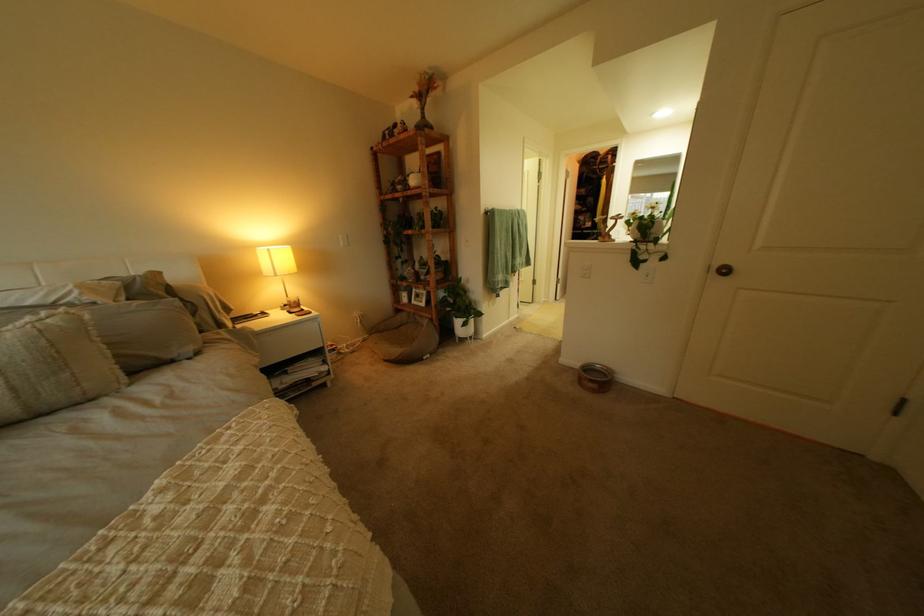
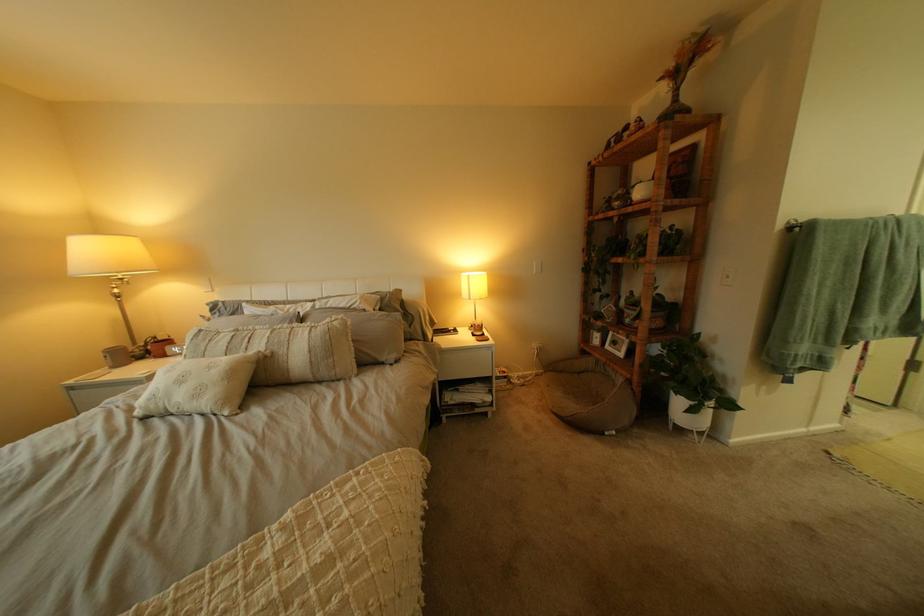
In the second image, find the point that corresponds to pixel 468 314 in the first image.

(687, 385)